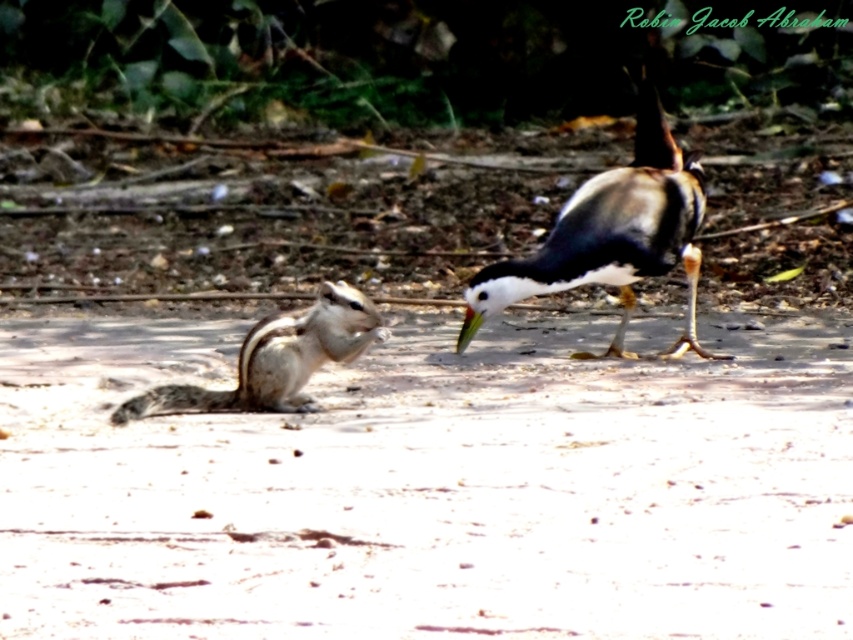
Question: Does brown sandy dirt at center appear under white and brown feathers at right?

Choices:
 (A) yes
 (B) no

Answer: (A)

Question: Is brown sandy dirt at center to the left of gray-furred squirrel at left from the viewer's perspective?

Choices:
 (A) no
 (B) yes

Answer: (A)

Question: Is white and brown feathers at right bigger than gray-furred squirrel at left?

Choices:
 (A) yes
 (B) no

Answer: (A)

Question: Which of the following is the farthest from the observer?

Choices:
 (A) white and brown feathers at right
 (B) brown sandy dirt at center
 (C) gray-furred squirrel at left

Answer: (A)

Question: Estimate the real-world distances between objects in this image. Which object is farther from the brown sandy dirt at center?

Choices:
 (A) white and brown feathers at right
 (B) gray-furred squirrel at left

Answer: (A)

Question: Which point is closer to the camera taking this photo?

Choices:
 (A) (322, 332)
 (B) (512, 284)

Answer: (A)